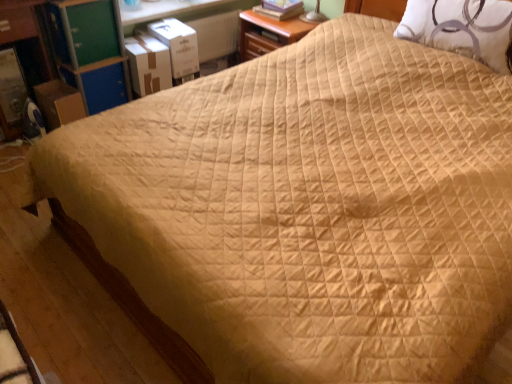
Locate an element on the screen. The height and width of the screenshot is (384, 512). brown wood dresser at left, which is the 2th dresser from right to left is located at coordinates (27, 39).

What do you see at coordinates (280, 9) in the screenshot?
I see `hardcover book at upper center` at bounding box center [280, 9].

Describe the element at coordinates (268, 33) in the screenshot. The image size is (512, 384). I see `wooden nightstand at upper center` at that location.

Where is `white cardboard box at upper left, acting as the 2th cardboard box starting from the right`? This screenshot has height=384, width=512. white cardboard box at upper left, acting as the 2th cardboard box starting from the right is located at coordinates (148, 64).

Considering the relative sizes of wooden nightstand at upper center and white cardboard box at upper left, the first cardboard box in the right-to-left sequence, in the image provided, is wooden nightstand at upper center taller than white cardboard box at upper left, the first cardboard box in the right-to-left sequence,?

Correct, wooden nightstand at upper center is much taller as white cardboard box at upper left, the first cardboard box in the right-to-left sequence.

Is wooden nightstand at upper center at the left side of white cardboard box at upper left, the first cardboard box in the right-to-left sequence?

In fact, wooden nightstand at upper center is to the right of white cardboard box at upper left, the first cardboard box in the right-to-left sequence.

Identify the location of nightstand beneath the white cardboard box at upper left, the first cardboard box in the right-to-left sequence (from a real-world perspective). (268, 33).

What's the angular difference between wooden nightstand at upper center and white cardboard box at upper left, which appears as the third cardboard box when viewed from the left,'s facing directions?

The facing directions of wooden nightstand at upper center and white cardboard box at upper left, which appears as the third cardboard box when viewed from the left, are 86.8 degrees apart.

From the image's perspective, relative to wooden nightstand at upper center, is brown wood dresser at left, which is the first dresser in left-to-right order, above or below?

brown wood dresser at left, which is the first dresser in left-to-right order, is below wooden nightstand at upper center.

Is brown wood dresser at left, which is the 2th dresser from right to left, to the left of wooden nightstand at upper center from the viewer's perspective?

Correct, you'll find brown wood dresser at left, which is the 2th dresser from right to left, to the left of wooden nightstand at upper center.

In the scene shown: Who is more distant, brown wood dresser at left, which is the first dresser in left-to-right order, or wooden nightstand at upper center?

wooden nightstand at upper center is further from the camera.

I want to click on the 1st dresser located above the wooden nightstand at upper center (from a real-world perspective), so click(x=27, y=39).

Find the location of a particular element. the 2nd dresser to the left when counting from the white quilted pillow at upper right is located at coordinates (27, 39).

Which is nearer, (34,7) or (470,36)?

The point (470,36) is more forward.

Can you confirm if brown wood dresser at left, which is the 2th dresser from right to left, is taller than white quilted pillow at upper right?

Correct, brown wood dresser at left, which is the 2th dresser from right to left, is much taller as white quilted pillow at upper right.

Is brown wood dresser at left, which is the 2th dresser from right to left, oriented away from white quilted pillow at upper right?

No, brown wood dresser at left, which is the 2th dresser from right to left, is not facing the opposite direction of white quilted pillow at upper right.

Does point (396, 35) come in front of point (254, 25)?

That is True.

From the image's perspective, between white quilted pillow at upper right and wooden nightstand at upper center, which one is located above?

From the image's view, wooden nightstand at upper center is above.

The height and width of the screenshot is (384, 512). I want to click on nightstand that appears above the white quilted pillow at upper right (from the image's perspective), so click(x=268, y=33).

Does white quilted pillow at upper right appear on the right side of wooden nightstand at upper center?

Indeed, white quilted pillow at upper right is positioned on the right side of wooden nightstand at upper center.

This screenshot has width=512, height=384. I want to click on dresser located above the brown wood dresser at left, which is the first dresser in left-to-right order (from the image's perspective), so click(x=76, y=45).

Which object is positioned more to the left, brown wood dresser at left, which is the 2th dresser from right to left, or green plastic dresser at upper left, which is the first dresser in right-to-left order?

brown wood dresser at left, which is the 2th dresser from right to left.

How different are the orientations of brown wood dresser at left, which is the 2th dresser from right to left, and green plastic dresser at upper left, which is the first dresser in right-to-left order, in degrees?

1.84 degrees separate the facing orientations of brown wood dresser at left, which is the 2th dresser from right to left, and green plastic dresser at upper left, which is the first dresser in right-to-left order.

Considering the sizes of objects brown wood dresser at left, which is the 2th dresser from right to left, and green plastic dresser at upper left, placed as the second dresser when sorted from left to right, in the image provided, who is wider, brown wood dresser at left, which is the 2th dresser from right to left, or green plastic dresser at upper left, placed as the second dresser when sorted from left to right,?

With larger width is brown wood dresser at left, which is the 2th dresser from right to left.

Between green plastic dresser at upper left, placed as the second dresser when sorted from left to right, and brown cardboard box at left, the third cardboard box when ordered from right to left, which one has larger width?

green plastic dresser at upper left, placed as the second dresser when sorted from left to right, is wider.

Between green plastic dresser at upper left, which is the first dresser in right-to-left order, and brown cardboard box at left, the third cardboard box when ordered from right to left, which one has more height?

Standing taller between the two is green plastic dresser at upper left, which is the first dresser in right-to-left order.

Consider the image. Which object is positioned more to the right, green plastic dresser at upper left, which is the first dresser in right-to-left order, or brown cardboard box at left, the third cardboard box when ordered from right to left?

green plastic dresser at upper left, which is the first dresser in right-to-left order, is more to the right.

Considering their positions, is green plastic dresser at upper left, which is the first dresser in right-to-left order, located in front of or behind brown cardboard box at left, marked as the 1th cardboard box in a left-to-right arrangement?

In the image, green plastic dresser at upper left, which is the first dresser in right-to-left order, appears in front of brown cardboard box at left, marked as the 1th cardboard box in a left-to-right arrangement.

From the image's perspective, which is below, hardcover book at upper center or white quilted pillow at upper right?

white quilted pillow at upper right, from the image's perspective.

From a real-world perspective, is hardcover book at upper center on top of white quilted pillow at upper right?

No, from a real-world perspective, hardcover book at upper center is not over white quilted pillow at upper right

Would you say hardcover book at upper center is inside or outside white quilted pillow at upper right?

hardcover book at upper center is not inside white quilted pillow at upper right, it's outside.

Who is shorter, hardcover book at upper center or white quilted pillow at upper right?

hardcover book at upper center is shorter.

This screenshot has height=384, width=512. Find the location of `nightstand that appears behind the white cardboard box at upper left, which appears as the third cardboard box when viewed from the left`. nightstand that appears behind the white cardboard box at upper left, which appears as the third cardboard box when viewed from the left is located at coordinates (268, 33).

Identify the location of nightstand above the brown wood dresser at left, which is the first dresser in left-to-right order (from the image's perspective). (268, 33).

Considering their positions, is white quilted pillow at upper right positioned further to white cardboard box at upper left, which appears as the third cardboard box when viewed from the left, than wooden nightstand at upper center?

white quilted pillow at upper right is further to white cardboard box at upper left, which appears as the third cardboard box when viewed from the left.

From the image, which object appears to be nearer to brown wood dresser at left, which is the first dresser in left-to-right order, white cardboard box at upper left, acting as the 2th cardboard box starting from the right, or white cardboard box at upper left, which appears as the third cardboard box when viewed from the left?

white cardboard box at upper left, acting as the 2th cardboard box starting from the right, lies closer to brown wood dresser at left, which is the first dresser in left-to-right order, than the other object.

Based on the photo, looking at the image, which one is located closer to green plastic dresser at upper left, placed as the second dresser when sorted from left to right, brown cardboard box at left, marked as the 1th cardboard box in a left-to-right arrangement, or white quilted pillow at upper right?

The object closer to green plastic dresser at upper left, placed as the second dresser when sorted from left to right, is brown cardboard box at left, marked as the 1th cardboard box in a left-to-right arrangement.

Based on their spatial positions, is brown wood dresser at left, which is the first dresser in left-to-right order, or wooden nightstand at upper center further from white cardboard box at upper left, which appears as the third cardboard box when viewed from the left?

The object further to white cardboard box at upper left, which appears as the third cardboard box when viewed from the left, is brown wood dresser at left, which is the first dresser in left-to-right order.

Based on their spatial positions, is white cardboard box at upper left, which appears as the third cardboard box when viewed from the left, or brown cardboard box at left, the third cardboard box when ordered from right to left, closer to hardcover book at upper center?

white cardboard box at upper left, which appears as the third cardboard box when viewed from the left, is positioned closer to the anchor hardcover book at upper center.

Considering their positions, is white cardboard box at upper left, which appears as the third cardboard box when viewed from the left, positioned closer to white cardboard box at upper left, acting as the 2th cardboard box starting from the right, than wooden nightstand at upper center?

Among the two, white cardboard box at upper left, which appears as the third cardboard box when viewed from the left, is located nearer to white cardboard box at upper left, acting as the 2th cardboard box starting from the right.

From the image, which object appears to be nearer to brown wood dresser at left, which is the first dresser in left-to-right order, white quilted pillow at upper right or brown cardboard box at left, marked as the 1th cardboard box in a left-to-right arrangement?

brown cardboard box at left, marked as the 1th cardboard box in a left-to-right arrangement.

Looking at the image, which one is located further to white cardboard box at upper left, which ranks as the second cardboard box in left-to-right order, green plastic dresser at upper left, placed as the second dresser when sorted from left to right, or wooden nightstand at upper center?

wooden nightstand at upper center lies further to white cardboard box at upper left, which ranks as the second cardboard box in left-to-right order, than the other object.

Where is `cardboard box between brown cardboard box at left, the third cardboard box when ordered from right to left, and white cardboard box at upper left, which appears as the third cardboard box when viewed from the left, from left to right`? The height and width of the screenshot is (384, 512). cardboard box between brown cardboard box at left, the third cardboard box when ordered from right to left, and white cardboard box at upper left, which appears as the third cardboard box when viewed from the left, from left to right is located at coordinates (148, 64).

Where is `dresser located between brown wood dresser at left, which is the 2th dresser from right to left, and white cardboard box at upper left, acting as the 2th cardboard box starting from the right, in the left-right direction`? This screenshot has width=512, height=384. dresser located between brown wood dresser at left, which is the 2th dresser from right to left, and white cardboard box at upper left, acting as the 2th cardboard box starting from the right, in the left-right direction is located at coordinates (76, 45).

Locate an element on the screen. nightstand positioned between white quilted pillow at upper right and hardcover book at upper center from near to far is located at coordinates (268, 33).

Identify the location of nightstand located between brown wood dresser at left, which is the 2th dresser from right to left, and white quilted pillow at upper right in the left-right direction. Image resolution: width=512 pixels, height=384 pixels. (268, 33).